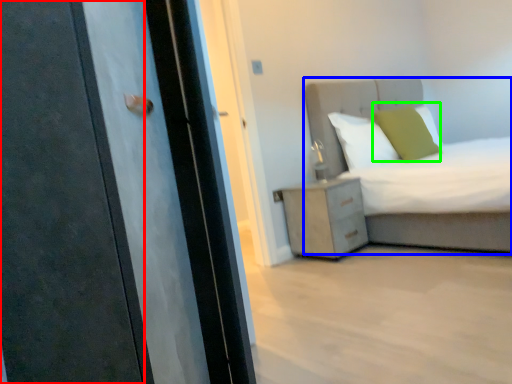
Question: Which object is the closest to the door (highlighted by a red box)? Choose among these: bed (highlighted by a blue box) or pillow (highlighted by a green box).

Choices:
 (A) bed
 (B) pillow

Answer: (A)